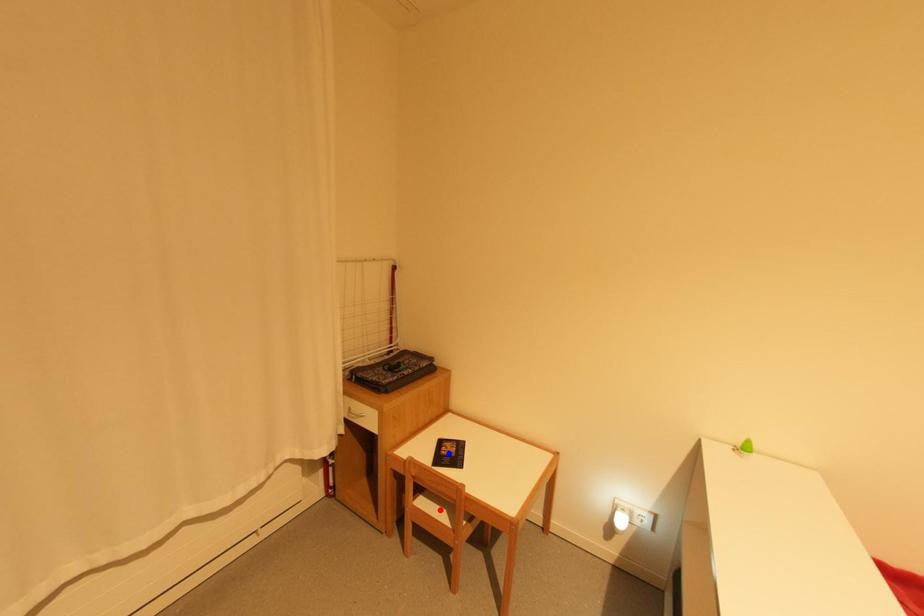
Question: Which of the two points in the image is closer to the camera?

Choices:
 (A) Blue point is closer.
 (B) Red point is closer.

Answer: (B)